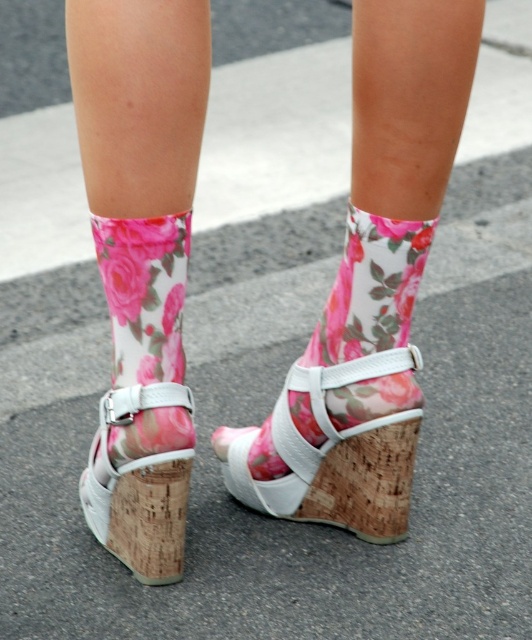
Based on the photo, you are a shoe designer analyzing the sandal in the image. Which part of the sandal, the white leather wedge at center or the cork heel at center, is positioned closer to the viewer?

The white leather wedge at center is positioned closer to the viewer than the cork heel at center.

You are standing in a park and see someone wearing floral socks at center. If you want to take a photo of their socks, where should you position yourself relative to their feet?

You should position yourself at point (371,282) relative to their feet to capture the floral socks at center in the photo.

You are a fashion stylist helping a client choose between two accessories on their feet. The client wants to know which item extends higher up their leg. Which one is taller between the floral fabric sock at lower center and the white cork wedge at lower center?

The floral fabric sock at lower center is taller than the white cork wedge at lower center according to the description.